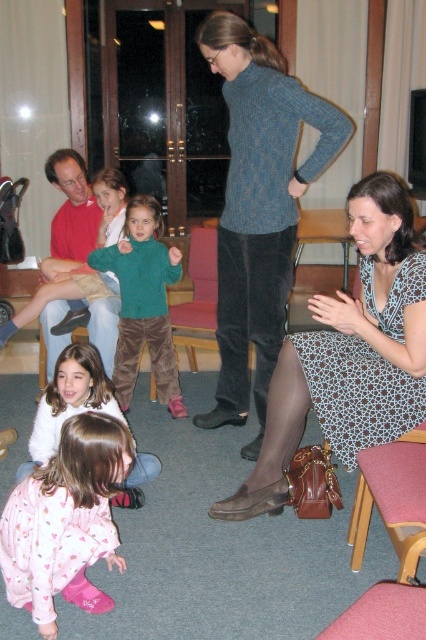
You are standing in the room and want to move from point A to point B. Point A is at coordinate point [333,385] and point B is at coordinate point [78,548]. Which point is closer to you when you are at the starting position?

Point A at coordinate point [333,385] is closer to you because it is further to the viewer than point B at coordinate point [78,548], meaning it is nearer in the visual perspective.

You are a photographer setting up a shoot in the described scene. You need to position a light source so it illuminates both the green corduroy sweater at center and the white fleece sweater at lower left without casting harsh shadows. Considering their heights, where should you place the light source relative to the sweaters?

The green corduroy sweater at center is taller than the white fleece sweater at lower left, so placing the light source above and slightly behind the green corduroy sweater at center would ensure both sweaters are illuminated evenly while minimizing harsh shadows.

You are trying to decide which sweater to take for a cold day. Both the green corduroy sweater at center and the white fleece sweater at lower left are options. Based on their sizes shown in the image, which one is narrower?

The green corduroy sweater at center is narrower than the white fleece sweater at lower left, so you should choose the green corduroy sweater at center if you prefer a narrower fit.